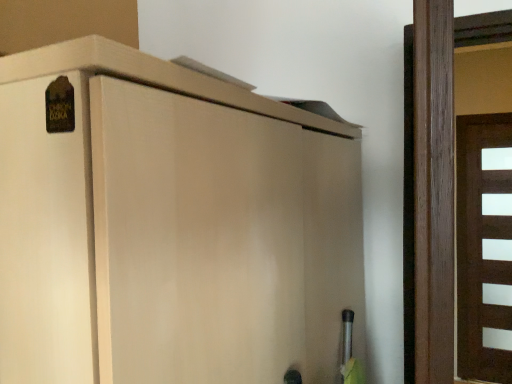
Question: Based on their positions, is brown matte door at right, placed as the 1th door when sorted from right to left, located to the left or right of matte wood cupboard at upper left?

Choices:
 (A) right
 (B) left

Answer: (A)

Question: Is point (468, 182) positioned closer to the camera than point (156, 190)?

Choices:
 (A) closer
 (B) farther

Answer: (B)

Question: Which of these objects is positioned farthest from the brown matte door at right, the 1th door positioned from the back?

Choices:
 (A) matte wood cupboard at upper left
 (B) brown wooden door at right, acting as the 1th door starting from the left

Answer: (A)

Question: Based on their relative distances, which object is farther from the brown wooden door at right, acting as the 1th door starting from the left?

Choices:
 (A) matte wood cupboard at upper left
 (B) brown matte door at right, the 1th door positioned from the back

Answer: (B)